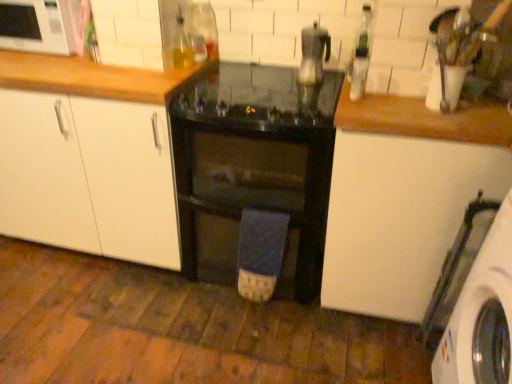
Locate an element on the screen. The height and width of the screenshot is (384, 512). free space that is to the left of blue cotton bath towel at center is located at coordinates (214, 302).